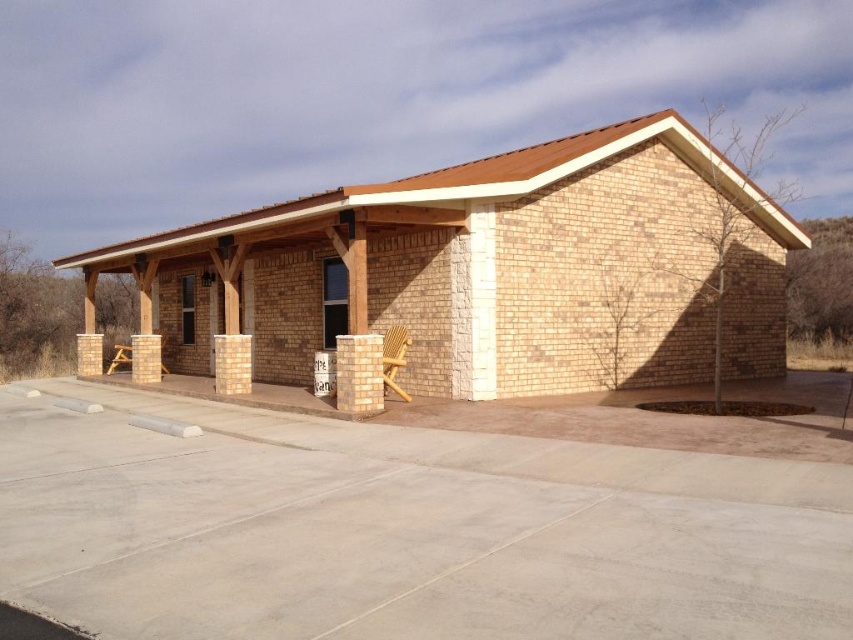
You are standing in front of the building and want to walk between the light brown brick pillar at center and the beige stone pillar at center. Which direction should you walk to pass between them?

The light brown brick pillar at center is to the right of the beige stone pillar at center, so you should walk towards the left side between them to pass through.

Looking at this image, you are planning to place a new bench in the front porch area of the building. The bench requires a space that is wider than the light brown wooden chair at center. Based on the scene, can the light brown brick pillar at center provide enough width for the bench?

The light brown brick pillar at center might be wider than the light brown wooden chair at center, so it could potentially provide sufficient width for the bench if the pillar is indeed wider. However, the exact dimensions are uncertain based on the provided information.

You are planning to place a decorative statue between the beige brick pillar at center and the beige stone pillar at center. Which pillar should the statue be closer to if you want it to be closer to the larger one?

The beige brick pillar at center is bigger than the beige stone pillar at center, so the statue should be closer to the beige brick pillar at center to be near the larger one.